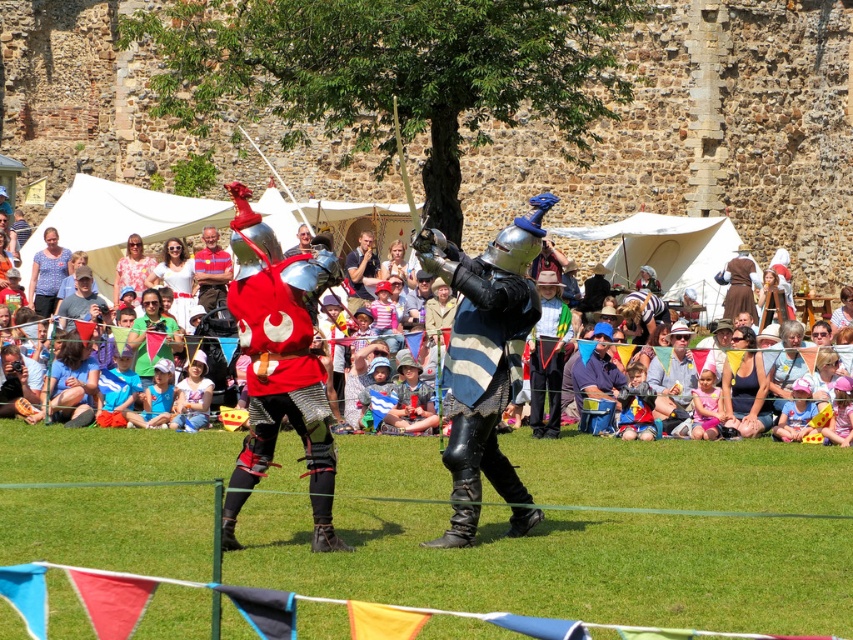
Question: Is shiny silver armor at center closer to camera compared to matte silver helmet at center?

Choices:
 (A) yes
 (B) no

Answer: (A)

Question: Is shiny silver armor at center to the right of matte silver helmet at center from the viewer's perspective?

Choices:
 (A) no
 (B) yes

Answer: (B)

Question: Which object appears farthest from the camera in this image?

Choices:
 (A) matte silver helmet at center
 (B) shiny silver armor at center

Answer: (A)

Question: Does shiny silver armor at center appear over matte silver helmet at center?

Choices:
 (A) no
 (B) yes

Answer: (A)